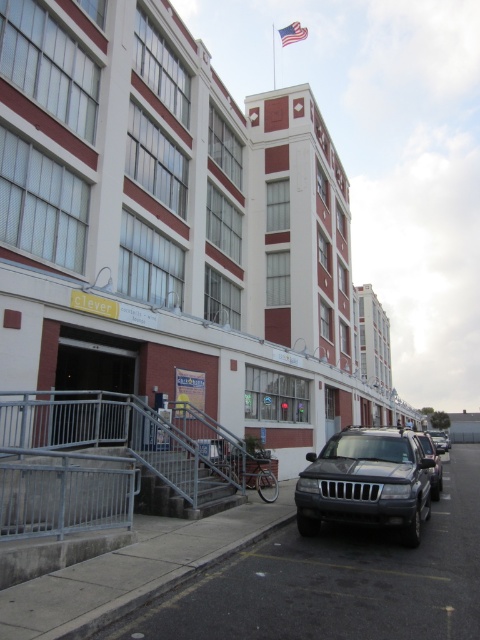
You are a delivery person trying to park your 2.5 meters tall delivery van. You see the satin black suv at lower center and the matte silver suv at center. Which vehicle should you park next to to ensure there is enough vertical clearance for your van?

The satin black suv at lower center has a greater height compared to matte silver suv at center. Therefore, parking next to the matte silver suv at center would provide more vertical clearance for your 2.5 meters tall delivery van.

You are a delivery driver who needs to park your matte silver suv at center near the entrance of the matte white building at center. Based on the scene, can you park your vehicle there without blocking the entrance?

The matte white building at center is larger in size than the matte silver suv at center. Since the building is larger, the entrance likely has enough space for the suv to park without blocking it. However, the presence of a bicycle parked near the entrance may require adjusting the parking position to accommodate both vehicles.

You are driving a car that is 1.8 meters wide. You need to park between the satin black suv at lower center and the matte silver suv at center. Can your car fit in the space between them?

The space between the satin black suv at lower center and the matte silver suv at center is 2.19 meters. Since your car is 1.8 meters wide, it can fit in the space between them as it is wider than the car.